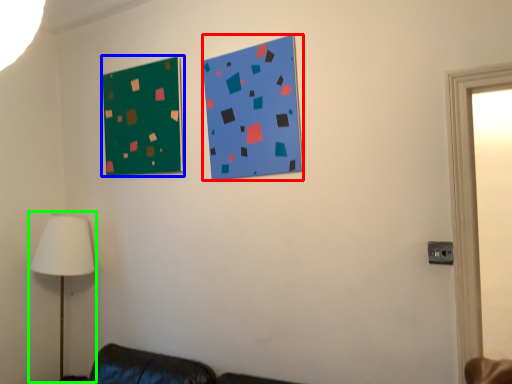
Question: Which object is positioned closest to bulletin board (highlighted by a red box)? Select from bulletin board (highlighted by a blue box) and table lamp (highlighted by a green box).

Choices:
 (A) bulletin board
 (B) table lamp

Answer: (A)